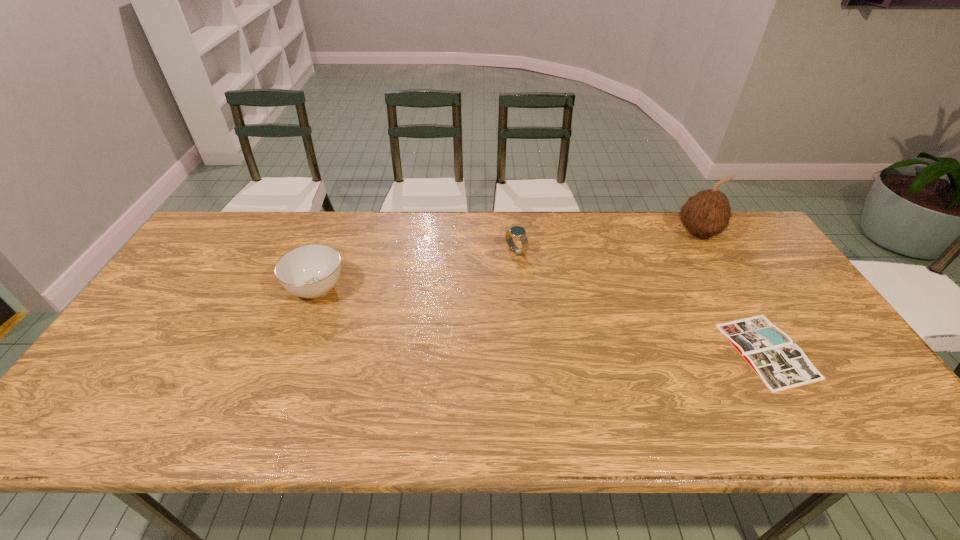
Where is `vacant region between the third object from right to left and the shortest object`? The image size is (960, 540). vacant region between the third object from right to left and the shortest object is located at coordinates (641, 301).

Where is `object that is the second closest to the third object from right to left`? The image size is (960, 540). object that is the second closest to the third object from right to left is located at coordinates (707, 213).

Find the location of a particular element. The height and width of the screenshot is (540, 960). the second closest object to the second nearest object is located at coordinates (781, 365).

You are a GUI agent. You are given a task and a screenshot of the screen. Output one action in this format:
    pyautogui.click(x=<x>, y=<y>)
    Task: Click on the free space that satisfies the following two spatial constraints: 1. on the surface of the tallest object; 2. on the left side of the book
    The image size is (960, 540).
    Given the screenshot: What is the action you would take?
    pyautogui.click(x=767, y=351)